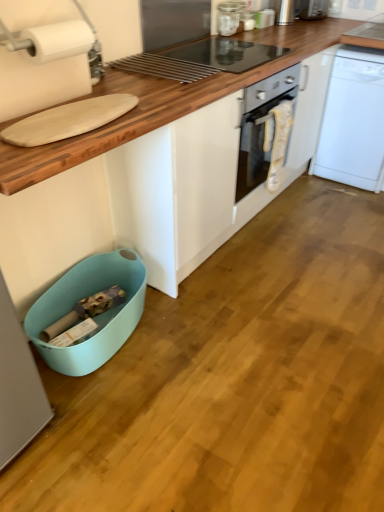
This screenshot has width=384, height=512. Identify the location of vacant area on top of wooden cutting board at upper left (from a real-world perspective). (158, 74).